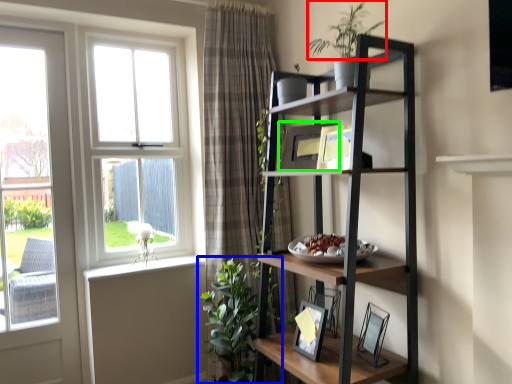
Question: Based on their relative distances, which object is nearer to vegetation (highlighted by a red box)? Choose from houseplant (highlighted by a blue box) and picture frame (highlighted by a green box).

Choices:
 (A) houseplant
 (B) picture frame

Answer: (B)